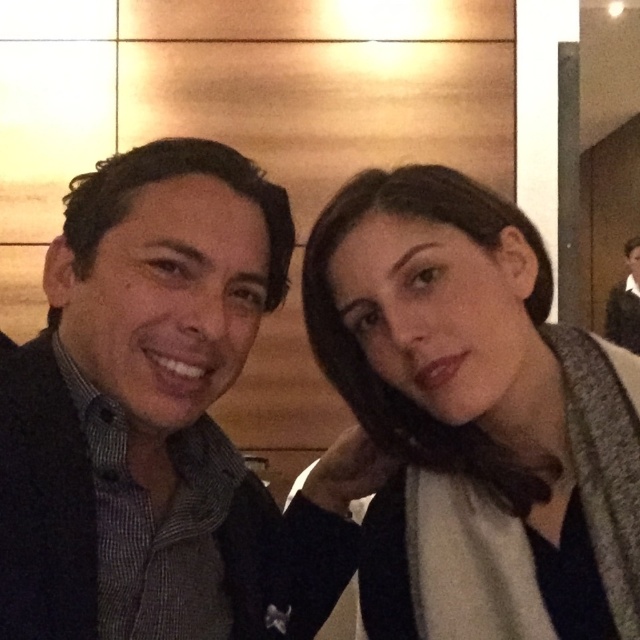
You are a photographer trying to adjust the lighting for a portrait. You notice the matte gray scarf at center and the matte black jacket at left in the frame. Which object should you adjust the lighting for to ensure it stands out more, considering their sizes?

The matte gray scarf at center has a lesser height compared to the matte black jacket at left. To ensure it stands out more, adjust the lighting on the smaller matte gray scarf at center so its details are more visible against the larger jacket.

You are a photographer trying to capture a closeup of the matte gray scarf at center and the dark brown leather jacket at upper right. Which object should you zoom in on to ensure both are in focus without moving the camera?

The matte gray scarf at center is smaller than the dark brown leather jacket at upper right, so you should zoom in on the dark brown leather jacket at upper right to ensure both are in focus without moving the camera.

You are a photographer setting up for a portrait session. You notice the matte gray scarf at center and the matte black jacket at left in the frame. Which item is positioned higher in the image?

The matte gray scarf at center is located above the matte black jacket at left, so it is positioned higher in the image.